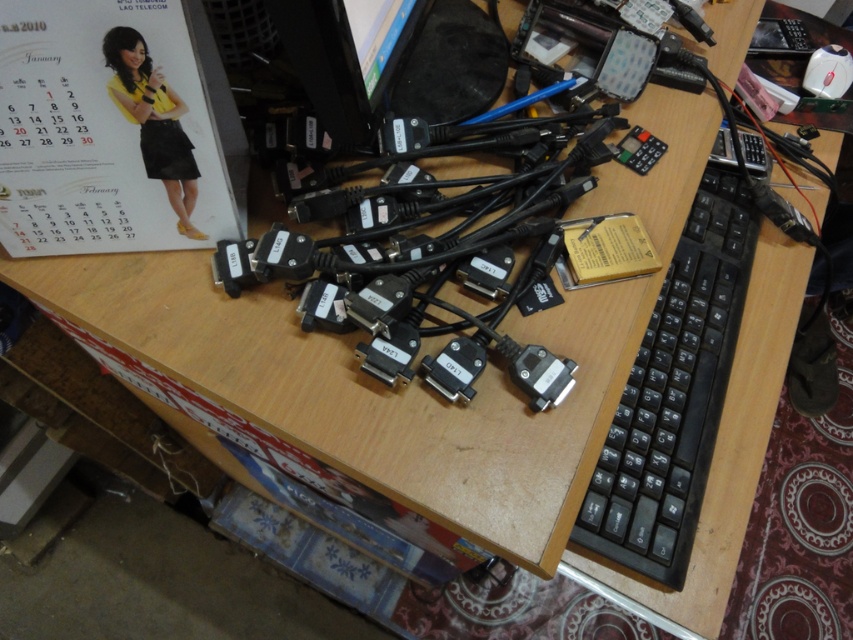
Question: Does black plastic keyboard at right appear under black plastic monitor at upper center?

Choices:
 (A) yes
 (B) no

Answer: (A)

Question: Which object is positioned farthest from the matte paper calendar at upper left?

Choices:
 (A) black plastic monitor at upper center
 (B) black plastic keyboard at right

Answer: (B)

Question: Which point appears closest to the camera in this image?

Choices:
 (A) (317, 100)
 (B) (654, 563)

Answer: (A)

Question: Which point is farther from the camera taking this photo?

Choices:
 (A) (184, 186)
 (B) (399, 16)
 (C) (709, 214)

Answer: (C)

Question: Does black plastic keyboard at right have a smaller size compared to black plastic monitor at upper center?

Choices:
 (A) no
 (B) yes

Answer: (A)

Question: Does black plastic keyboard at right appear on the left side of black plastic monitor at upper center?

Choices:
 (A) no
 (B) yes

Answer: (A)